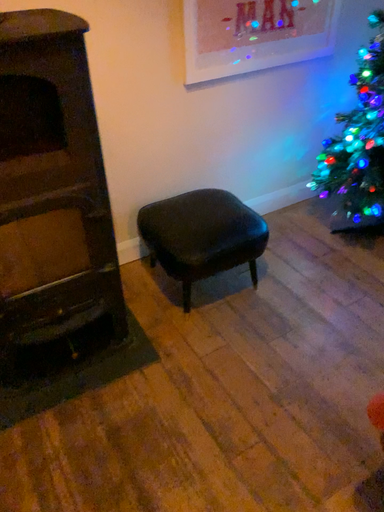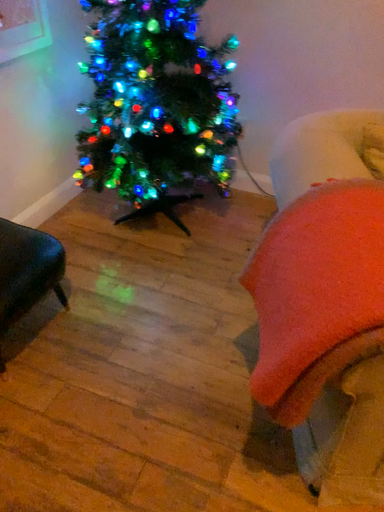
Question: How did the camera likely rotate when shooting the video?

Choices:
 (A) rotated left
 (B) rotated right

Answer: (B)